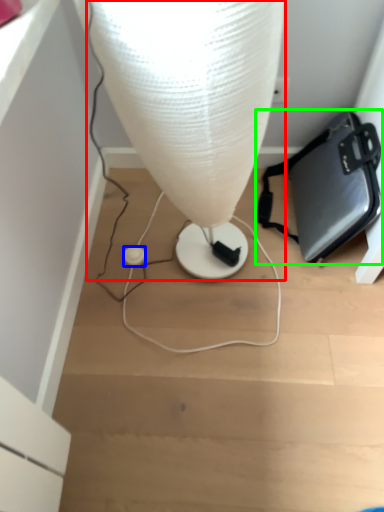
Question: Which object is the closest to the lamp (highlighted by a red box)? Choose among these: earphone (highlighted by a blue box) or handbag (highlighted by a green box).

Choices:
 (A) earphone
 (B) handbag

Answer: (B)